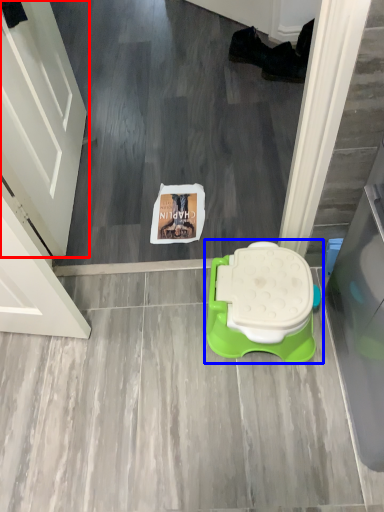
Question: Which object is closer to the camera taking this photo, door (highlighted by a red box) or toilet (highlighted by a blue box)?

Choices:
 (A) door
 (B) toilet

Answer: (A)